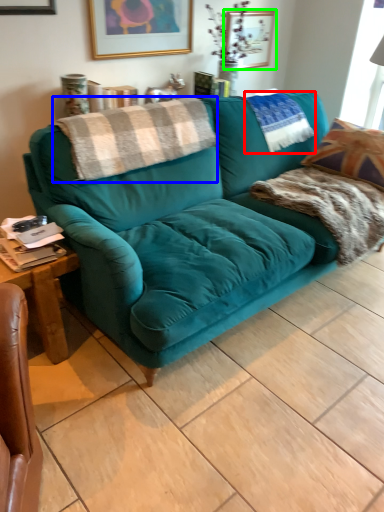
Question: Estimate the real-world distances between objects in this image. Which object is closer to pillow (highlighted by a red box), blanket (highlighted by a blue box) or picture frame (highlighted by a green box)?

Choices:
 (A) blanket
 (B) picture frame

Answer: (B)